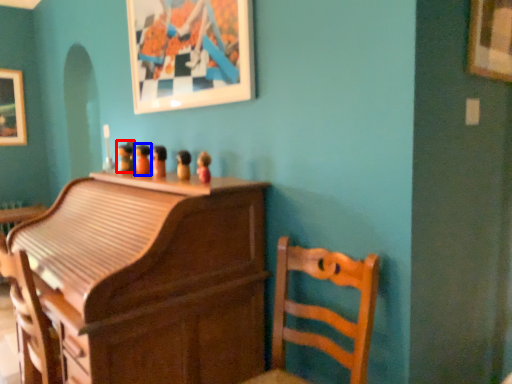
Question: Which object is further to the camera taking this photo, toy (highlighted by a red box) or toy (highlighted by a blue box)?

Choices:
 (A) toy
 (B) toy

Answer: (A)